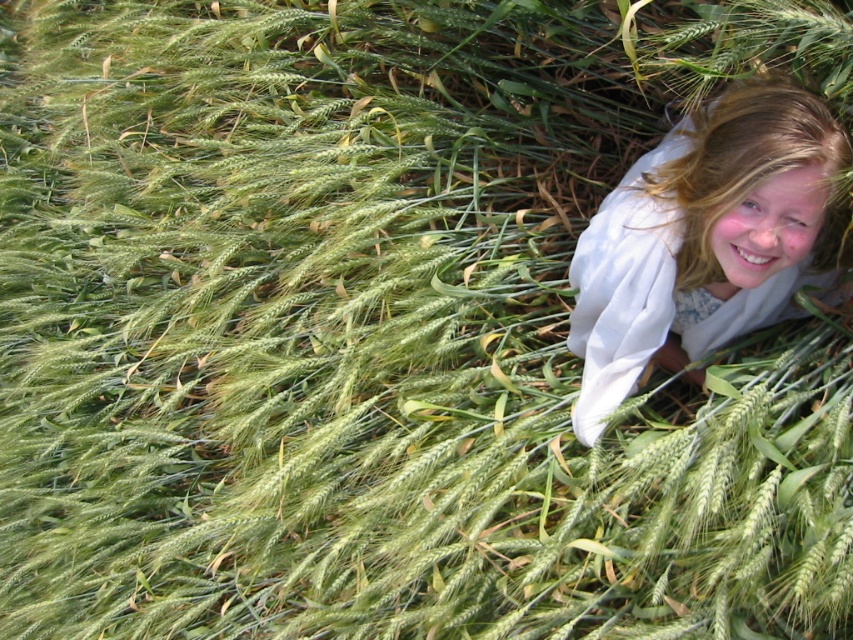
In the serene outdoor scene with tall green wheat, there are two people with light brown hair at upper right and blonde hair at upper right. Which person has wider hair?

The light brown hair at upper right is wider than the blonde hair at upper right.

You are an artist trying to paint the scene. You want to place the light brown hair at upper right in your painting. What are the coordinates where you should place it?

The light brown hair at upper right should be placed at coordinates (705, 241).